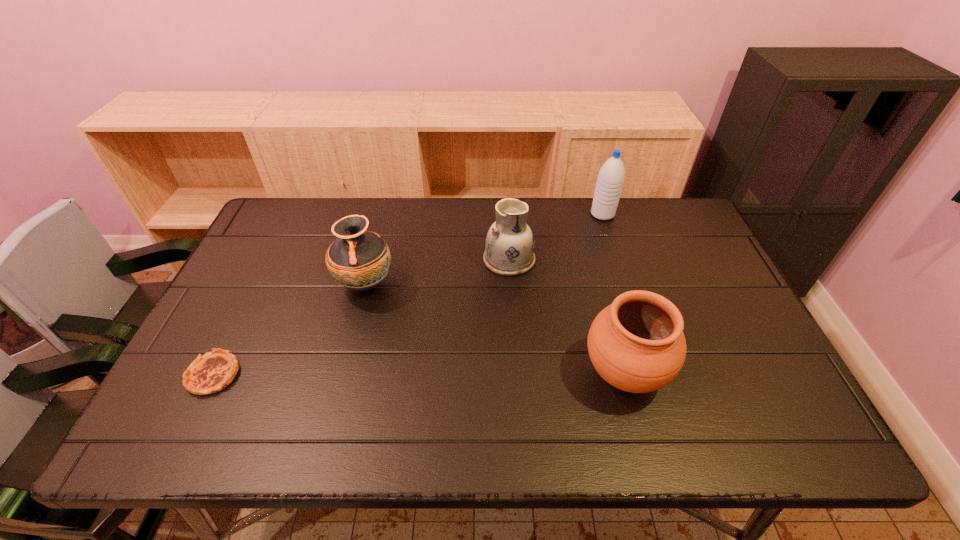
In the image, there is a desktop. At what (x,y) coordinates should I click in order to perform the action: click on vacant space at the far right corner. Please return your answer as a coordinate pair (x, y). This screenshot has width=960, height=540. Looking at the image, I should click on (673, 230).

This screenshot has width=960, height=540. What are the coordinates of `free space that is in between the farthest object and the leftmost pottery` in the screenshot? It's located at (484, 249).

Find the location of a particular element. The height and width of the screenshot is (540, 960). blank region between the quiche and the second object from left to right is located at coordinates (289, 329).

The width and height of the screenshot is (960, 540). What are the coordinates of `free space between the leftmost pottery and the second pottery from right to left` in the screenshot? It's located at (438, 272).

This screenshot has height=540, width=960. In order to click on free space between the shortest object and the farthest object in this screenshot , I will do `click(408, 294)`.

Identify the location of vacant area between the nearest pottery and the second object from left to right. (494, 328).

Find the location of a particular element. vacant area that lies between the second pottery from right to left and the shortest object is located at coordinates (361, 317).

Where is `vacant area that lies between the farthest object and the second object from left to right`? The image size is (960, 540). vacant area that lies between the farthest object and the second object from left to right is located at coordinates (484, 249).

Locate an element on the screen. The width and height of the screenshot is (960, 540). vacant region between the leftmost object and the second pottery from left to right is located at coordinates (361, 317).

Locate an element on the screen. This screenshot has width=960, height=540. free space between the leftmost object and the water bottle is located at coordinates (408, 294).